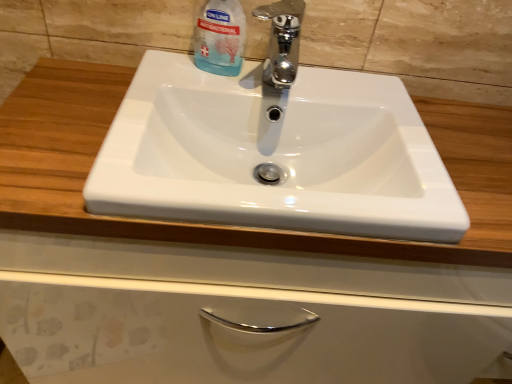
Describe the element at coordinates (220, 37) in the screenshot. This screenshot has width=512, height=384. I see `transparent plastic bottle at upper center` at that location.

What are the coordinates of `transparent plastic bottle at upper center` in the screenshot? It's located at (220, 37).

You are a GUI agent. You are given a task and a screenshot of the screen. Output one action in this format:
    pyautogui.click(x=<x>, y=<y>)
    Task: Click on the chrome metallic faucet at center
    The width and height of the screenshot is (512, 384).
    Given the screenshot: What is the action you would take?
    pyautogui.click(x=282, y=41)

Considering the sizes of objects white glossy sink at center and chrome metallic faucet at center in the image provided, who is thinner, white glossy sink at center or chrome metallic faucet at center?

Thinner between the two is chrome metallic faucet at center.

Is white glossy sink at center inside the boundaries of chrome metallic faucet at center, or outside?

white glossy sink at center lies outside chrome metallic faucet at center.

Is white glossy sink at center at the right side of chrome metallic faucet at center?

Incorrect, white glossy sink at center is not on the right side of chrome metallic faucet at center.

Measure the distance from white glossy sink at center to chrome metallic faucet at center.

A distance of 6.87 inches exists between white glossy sink at center and chrome metallic faucet at center.

Considering the sizes of objects chrome metallic faucet at center and white glossy sink at center in the image provided, who is taller, chrome metallic faucet at center or white glossy sink at center?

With more height is chrome metallic faucet at center.

Is chrome metallic faucet at center wider than white glossy sink at center?

No, chrome metallic faucet at center is not wider than white glossy sink at center.

Is chrome metallic faucet at center facing away from white glossy sink at center?

No.

This screenshot has width=512, height=384. In order to click on sink below the chrome metallic faucet at center (from the image's perspective) in this screenshot , I will do `click(274, 153)`.

Can you tell me how much transparent plastic bottle at upper center and white glossy sink at center differ in facing direction?

0.483 degrees.

Is transparent plastic bottle at upper center smaller than white glossy sink at center?

Indeed, transparent plastic bottle at upper center has a smaller size compared to white glossy sink at center.

Considering the positions of objects transparent plastic bottle at upper center and white glossy sink at center in the image provided, who is more to the left, transparent plastic bottle at upper center or white glossy sink at center?

transparent plastic bottle at upper center.

Based on the photo, which point is more forward, (231, 58) or (259, 98)?

The point (259, 98) is in front.

Is transparent plastic bottle at upper center at the right side of chrome metallic faucet at center?

Incorrect, transparent plastic bottle at upper center is not on the right side of chrome metallic faucet at center.

Could you tell me if transparent plastic bottle at upper center is facing chrome metallic faucet at center?

No.

Would you consider transparent plastic bottle at upper center to be distant from chrome metallic faucet at center?

No, transparent plastic bottle at upper center is not far away from chrome metallic faucet at center.

Find the location of a particular element. The width and height of the screenshot is (512, 384). tap that appears on the right of transparent plastic bottle at upper center is located at coordinates (282, 41).

This screenshot has height=384, width=512. What are the coordinates of `cleaning product on the left of white glossy sink at center` in the screenshot? It's located at (220, 37).

From a real-world perspective, is white glossy sink at center positioned above or below transparent plastic bottle at upper center?

From a real-world perspective, white glossy sink at center is physically below transparent plastic bottle at upper center.

Is white glossy sink at center looking in the opposite direction of transparent plastic bottle at upper center?

No.

How different are the orientations of white glossy sink at center and transparent plastic bottle at upper center in degrees?

The facing directions of white glossy sink at center and transparent plastic bottle at upper center are 0.483 degrees apart.

Is point (278, 7) closer to viewer compared to point (242, 21)?

Yes, point (278, 7) is in front of point (242, 21).

Measure the distance between chrome metallic faucet at center and transparent plastic bottle at upper center.

7.63 centimeters.

What's the angular difference between chrome metallic faucet at center and transparent plastic bottle at upper center's facing directions?

0.881 degrees.

Does chrome metallic faucet at center turn towards transparent plastic bottle at upper center?

No, chrome metallic faucet at center is not oriented towards transparent plastic bottle at upper center.

Locate an element on the screen. The image size is (512, 384). sink beneath the chrome metallic faucet at center (from a real-world perspective) is located at coordinates (274, 153).

At what (x,y) coordinates should I click in order to perform the action: click on tap on the right of white glossy sink at center. Please return your answer as a coordinate pair (x, y). The image size is (512, 384). Looking at the image, I should click on (282, 41).

Considering their positions, is transparent plastic bottle at upper center positioned further to chrome metallic faucet at center than white glossy sink at center?

white glossy sink at center is positioned further to the anchor chrome metallic faucet at center.

Estimate the real-world distances between objects in this image. Which object is closer to transparent plastic bottle at upper center, chrome metallic faucet at center or white glossy sink at center?

chrome metallic faucet at center.

Estimate the real-world distances between objects in this image. Which object is further from transparent plastic bottle at upper center, white glossy sink at center or chrome metallic faucet at center?

Based on the image, white glossy sink at center appears to be further to transparent plastic bottle at upper center.

Based on their spatial positions, is chrome metallic faucet at center or transparent plastic bottle at upper center further from white glossy sink at center?

transparent plastic bottle at upper center lies further to white glossy sink at center than the other object.

From the image, which object appears to be nearer to white glossy sink at center, transparent plastic bottle at upper center or chrome metallic faucet at center?

Based on the image, chrome metallic faucet at center appears to be nearer to white glossy sink at center.

Which object lies nearer to the anchor point chrome metallic faucet at center, white glossy sink at center or transparent plastic bottle at upper center?

transparent plastic bottle at upper center.

You are a GUI agent. You are given a task and a screenshot of the screen. Output one action in this format:
    pyautogui.click(x=<x>, y=<y>)
    Task: Click on the tap that lies between transparent plastic bottle at upper center and white glossy sink at center from top to bottom
    Image resolution: width=512 pixels, height=384 pixels.
    Given the screenshot: What is the action you would take?
    pyautogui.click(x=282, y=41)